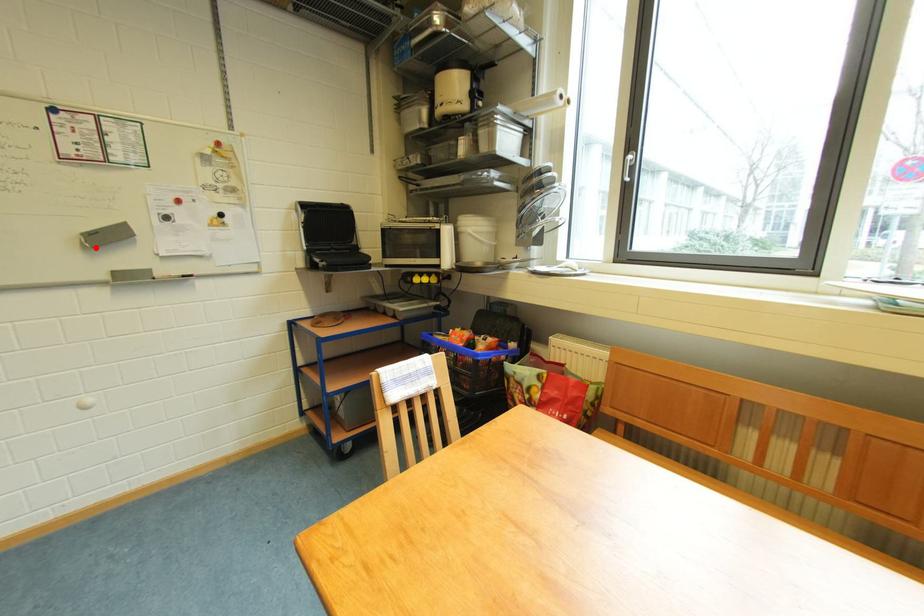
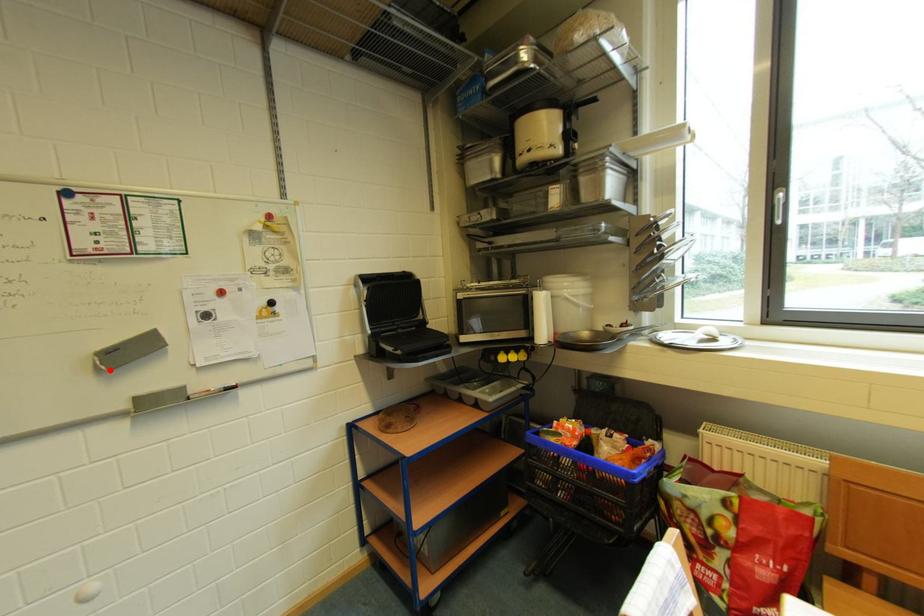
I am providing you with two images of the same scene from different viewpoints. A red point is marked on the first image and another point is marked on the second image. Is the marked point in image1 the same physical position as the marked point in image2?

Yes